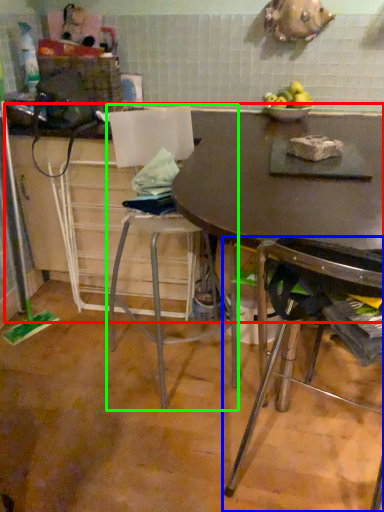
Question: Estimate the real-world distances between objects in this image. Which object is farther from counter top (highlighted by a red box), chair (highlighted by a blue box) or chair (highlighted by a green box)?

Choices:
 (A) chair
 (B) chair

Answer: (B)